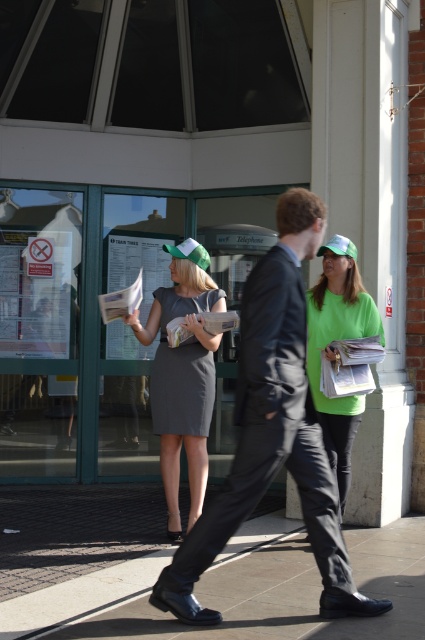
Is slate gray concrete at center closer to camera compared to dark gray matte dress at center?

Yes.

This screenshot has width=425, height=640. In order to click on slate gray concrete at center in this screenshot , I will do `click(200, 580)`.

Is point (220, 572) behind point (152, 396)?

No, (220, 572) is in front of (152, 396).

Where is `slate gray concrete at center`? slate gray concrete at center is located at coordinates (200, 580).

Where is `matte gray dress at center`? Image resolution: width=425 pixels, height=640 pixels. matte gray dress at center is located at coordinates (183, 376).

Does matte gray dress at center appear on the right side of dark gray matte dress at center?

Incorrect, matte gray dress at center is not on the right side of dark gray matte dress at center.

Does point (192, 456) come closer to viewer compared to point (204, 424)?

No, (192, 456) is behind (204, 424).

At what (x,y) coordinates should I click in order to perform the action: click on matte gray dress at center. Please return your answer as a coordinate pair (x, y). This screenshot has width=425, height=640. Looking at the image, I should click on (183, 376).

Looking at this image, is slate gray concrete at center to the right of matte gray dress at center from the viewer's perspective?

Correct, you'll find slate gray concrete at center to the right of matte gray dress at center.

Who is taller, slate gray concrete at center or matte gray dress at center?

Standing taller between the two is matte gray dress at center.

The width and height of the screenshot is (425, 640). Find the location of `slate gray concrete at center`. slate gray concrete at center is located at coordinates (200, 580).